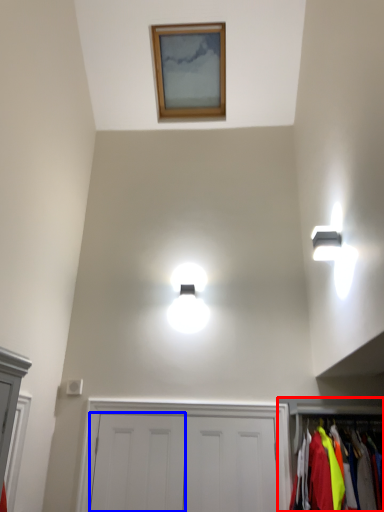
Question: Among these objects, which one is farthest to the camera, dresser (highlighted by a red box) or door (highlighted by a blue box)?

Choices:
 (A) dresser
 (B) door

Answer: (B)